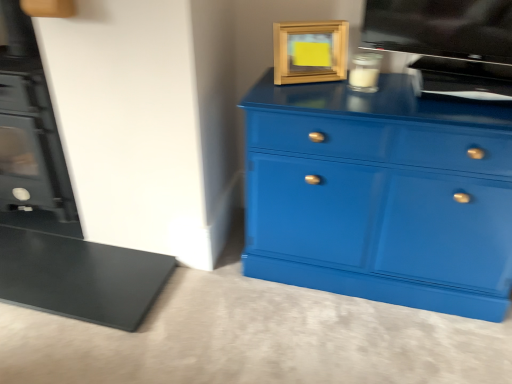
Find the location of `free spot to the left of glossy blue chest of drawers at center`. free spot to the left of glossy blue chest of drawers at center is located at coordinates (222, 312).